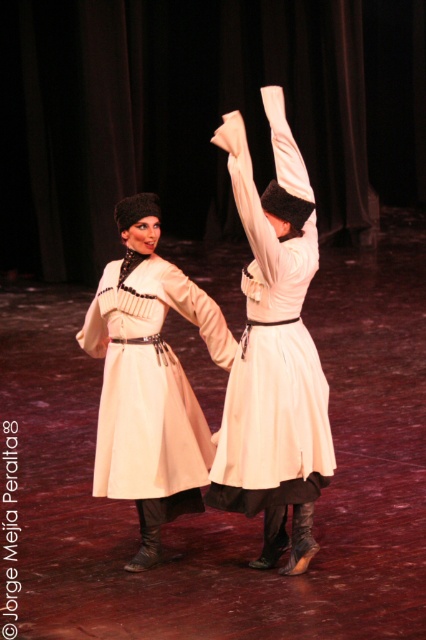
This screenshot has height=640, width=426. In order to click on matte white dress at center in this screenshot , I will do `click(219, 364)`.

Does matte white dress at center appear on the left side of matte white coat at center?

No, matte white dress at center is not to the left of matte white coat at center.

The image size is (426, 640). Describe the element at coordinates (219, 364) in the screenshot. I see `matte white dress at center` at that location.

Identify the location of matte white dress at center. (219, 364).

Does point (273, 198) lie behind point (120, 451)?

No, it is in front of (120, 451).

What do you see at coordinates (273, 339) in the screenshot? This screenshot has height=640, width=426. I see `white satin dress at center` at bounding box center [273, 339].

Find the location of `white satin dress at center`. white satin dress at center is located at coordinates (273, 339).

Which of these two, white satin dress at center or matte white coat at upper center, stands taller?

With more height is white satin dress at center.

Who is more distant from viewer, (x=282, y=484) or (x=184, y=288)?

The point (x=184, y=288) is behind.

Locate an element on the screen. The image size is (426, 640). white satin dress at center is located at coordinates (273, 339).